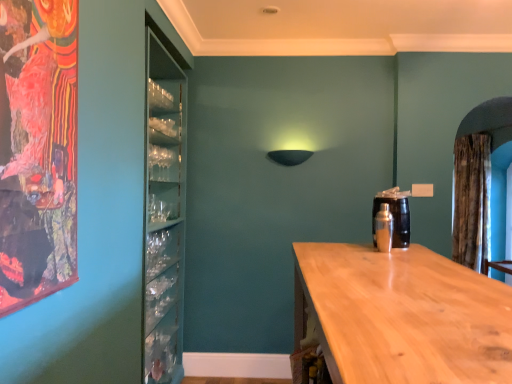
Question: From a real-world perspective, is brown textured curtain at right below silver metallic shaker at right?

Choices:
 (A) no
 (B) yes

Answer: (A)

Question: Is brown textured curtain at right aimed at silver metallic shaker at right?

Choices:
 (A) no
 (B) yes

Answer: (A)

Question: Is silver metallic shaker at right at the back of brown textured curtain at right?

Choices:
 (A) yes
 (B) no

Answer: (B)

Question: Is brown textured curtain at right further to the viewer compared to silver metallic shaker at right?

Choices:
 (A) yes
 (B) no

Answer: (A)

Question: Is brown textured curtain at right not inside silver metallic shaker at right?

Choices:
 (A) yes
 (B) no

Answer: (A)

Question: Is point (399, 352) closer or farther from the camera than point (478, 269)?

Choices:
 (A) farther
 (B) closer

Answer: (B)

Question: Considering their positions, is light wood countertop at center located in front of or behind brown textured curtain at right?

Choices:
 (A) behind
 (B) front

Answer: (B)

Question: From a real-world perspective, relative to brown textured curtain at right, is light wood countertop at center vertically above or below?

Choices:
 (A) below
 (B) above

Answer: (A)

Question: Is light wood countertop at center taller or shorter than brown textured curtain at right?

Choices:
 (A) tall
 (B) short

Answer: (B)

Question: Visually, is brown textured curtain at right positioned to the left or to the right of silver metallic shaker at right?

Choices:
 (A) left
 (B) right

Answer: (B)

Question: From the image's perspective, relative to silver metallic shaker at right, is brown textured curtain at right above or below?

Choices:
 (A) below
 (B) above

Answer: (B)

Question: Considering the positions of brown textured curtain at right and silver metallic shaker at right in the image, is brown textured curtain at right bigger or smaller than silver metallic shaker at right?

Choices:
 (A) big
 (B) small

Answer: (A)

Question: Is point (487, 167) positioned closer to the camera than point (389, 233)?

Choices:
 (A) farther
 (B) closer

Answer: (A)

Question: Is brown textured curtain at right taller or shorter than light wood countertop at center?

Choices:
 (A) short
 (B) tall

Answer: (B)

Question: Looking at the image, does brown textured curtain at right seem bigger or smaller compared to light wood countertop at center?

Choices:
 (A) small
 (B) big

Answer: (A)